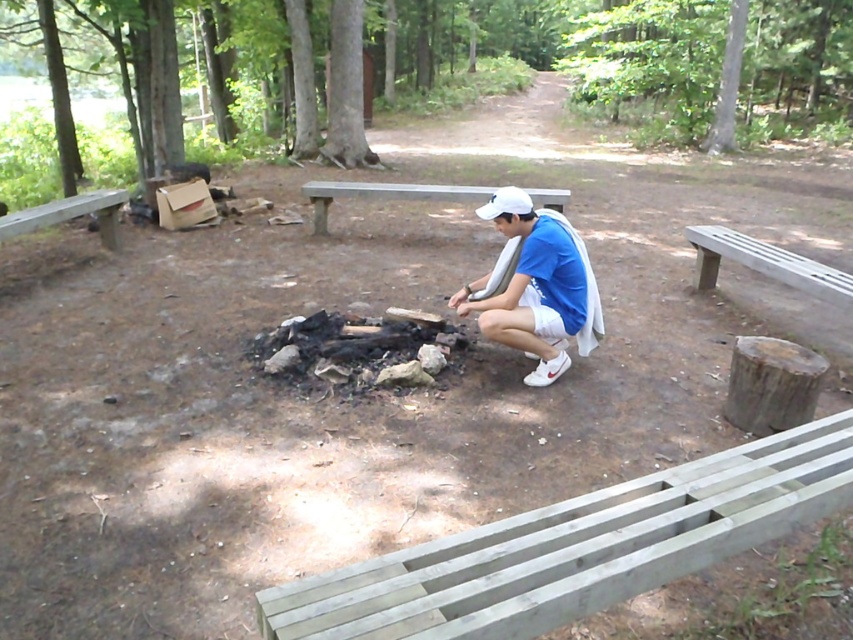
Who is higher up, gray wooden bench at lower right or wooden bench at center?

Positioned higher is wooden bench at center.

Does gray wooden bench at lower right have a lesser height compared to wooden bench at center?

Indeed, gray wooden bench at lower right has a lesser height compared to wooden bench at center.

Is point (496, 525) more distant than point (544, 193)?

No, it is in front of (544, 193).

I want to click on gray wooden bench at lower right, so click(x=575, y=547).

Is wooden bench at left thinner than wooden bench at center?

Yes, wooden bench at left is thinner than wooden bench at center.

Where is `wooden bench at left`? Image resolution: width=853 pixels, height=640 pixels. wooden bench at left is located at coordinates coord(51,236).

Consider the image. Who is more forward, (0,262) or (397,193)?

Positioned in front is point (0,262).

Find the location of `wooden bench at left`. wooden bench at left is located at coordinates (51, 236).

Does wooden bench at left have a lesser height compared to gray wooden bench at right?

No, wooden bench at left is not shorter than gray wooden bench at right.

Looking at this image, who is positioned more to the left, wooden bench at left or gray wooden bench at right?

wooden bench at left

Image resolution: width=853 pixels, height=640 pixels. Describe the element at coordinates (51, 236) in the screenshot. I see `wooden bench at left` at that location.

This screenshot has width=853, height=640. I want to click on wooden bench at left, so click(x=51, y=236).